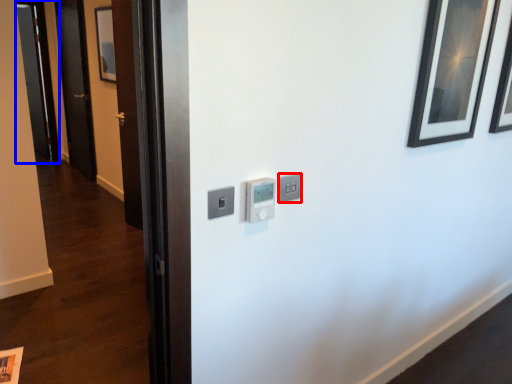
Question: Which of the following is the farthest to the observer, light switch (highlighted by a red box) or glass door (highlighted by a blue box)?

Choices:
 (A) light switch
 (B) glass door

Answer: (B)